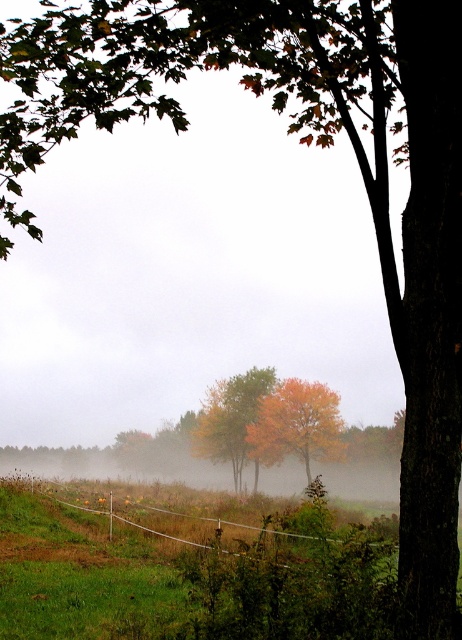
Question: Can you confirm if green wire fence at lower center is bigger than autumn leaves at center?

Choices:
 (A) yes
 (B) no

Answer: (A)

Question: Among these points, which one is nearest to the camera?

Choices:
 (A) (291, 444)
 (B) (257, 381)
 (C) (224, 525)

Answer: (C)

Question: Considering the real-world distances, which object is farthest from the green wire fence at lower center?

Choices:
 (A) orange matte tree at center
 (B) autumn leaves at center

Answer: (B)

Question: Can you confirm if green wire fence at lower center is positioned to the left of autumn leaves at center?

Choices:
 (A) no
 (B) yes

Answer: (A)

Question: Can you confirm if green wire fence at lower center is positioned to the left of autumn leaves at center?

Choices:
 (A) yes
 (B) no

Answer: (B)

Question: Which is nearer to the autumn leaves at center?

Choices:
 (A) green wire fence at lower center
 (B) orange matte tree at center

Answer: (B)